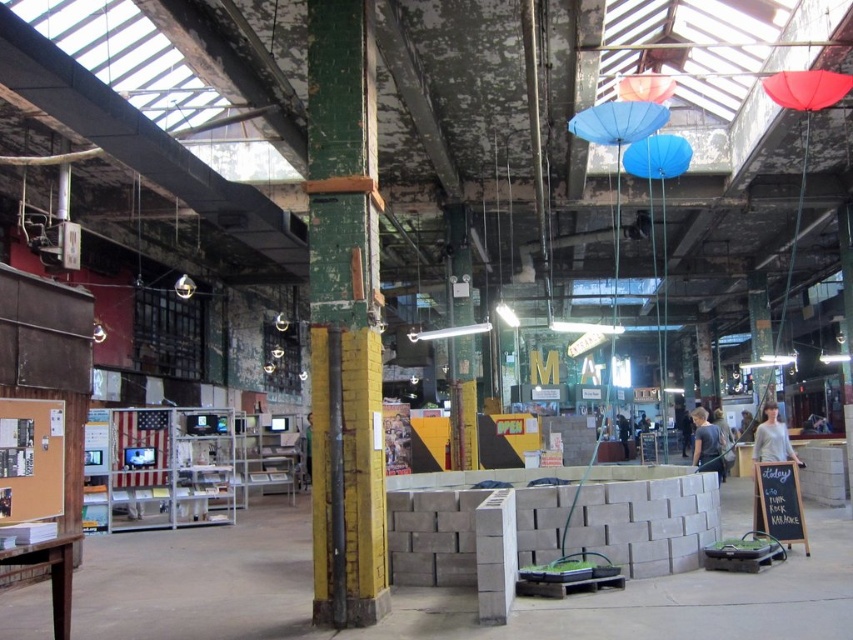
Is point (772, 420) farther from camera compared to point (708, 467)?

No, it is in front of (708, 467).

Who is more distant from viewer, (778, 442) or (701, 426)?

The point (701, 426) is behind.

Is point (756, 451) farther from viewer compared to point (717, 456)?

That is False.

Identify the location of gray cotton shirt at right. (772, 438).

Does point (347, 109) come in front of point (647, 108)?

Yes, it is in front of point (647, 108).

Is green painted wood at center bigger than blue fabric umbrella at upper center?

Yes.

Identify the location of green painted wood at center. This screenshot has width=853, height=640. (344, 317).

The height and width of the screenshot is (640, 853). I want to click on green painted wood at center, so coord(344,317).

Does blue fabric umbrella at upper center have a greater width compared to light brown leather jacket at center?

Correct, the width of blue fabric umbrella at upper center exceeds that of light brown leather jacket at center.

Between blue fabric umbrella at upper center and light brown leather jacket at center, which one is positioned higher?

blue fabric umbrella at upper center is higher up.

The width and height of the screenshot is (853, 640). Find the location of `blue fabric umbrella at upper center`. blue fabric umbrella at upper center is located at coordinates (618, 122).